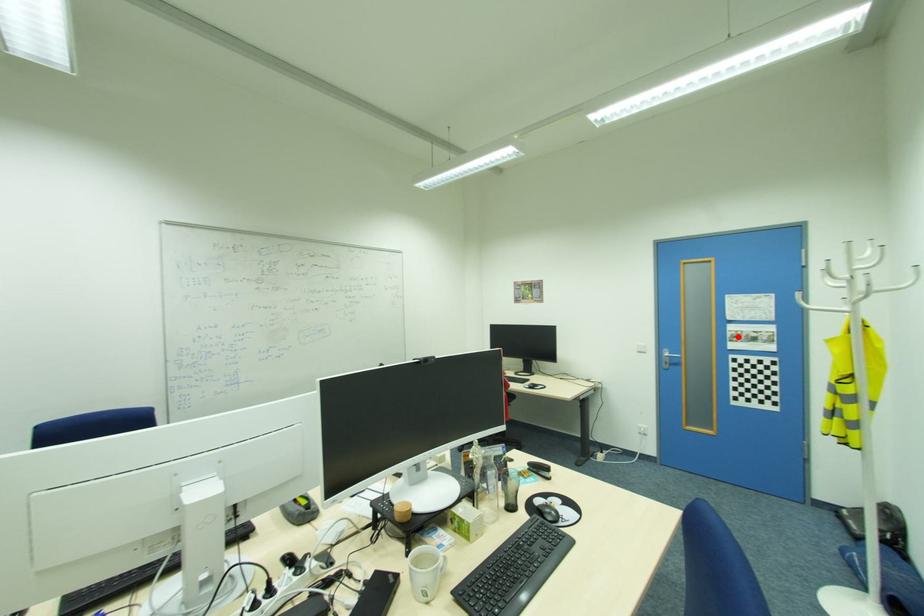
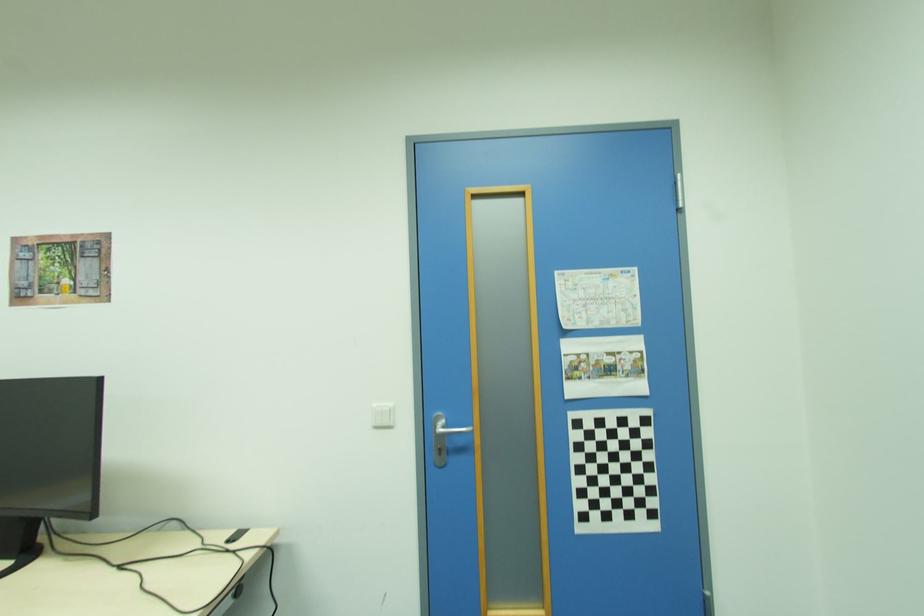
The point at the highlighted location is marked in the first image. Where is the corresponding point in the second image?

(579, 369)